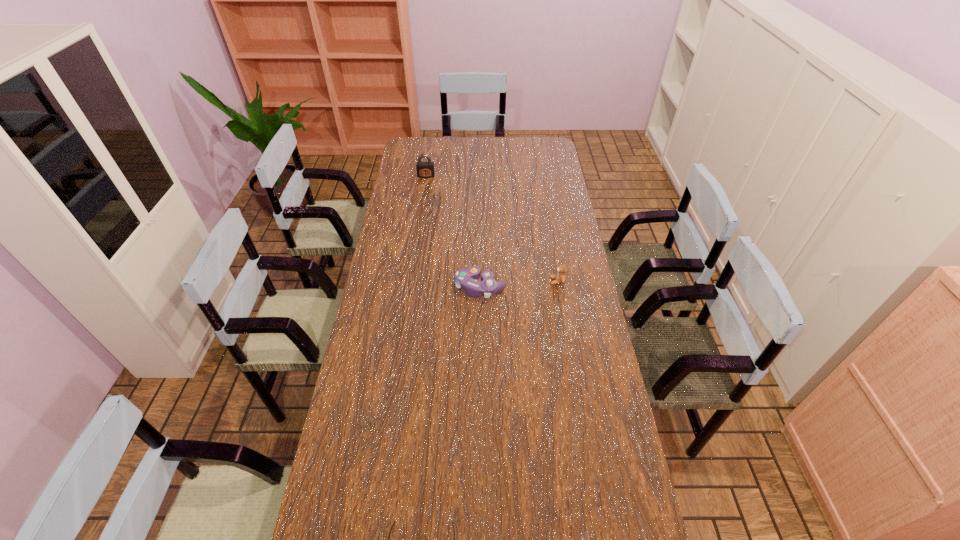
Find the location of a particular element. Image resolution: width=960 pixels, height=540 pixels. vacant space that is in between the teddy bear and the control is located at coordinates (518, 285).

The height and width of the screenshot is (540, 960). I want to click on object that is the closest to the rightmost object, so click(x=465, y=278).

Locate which object is the second closest to the control. Please provide its 2D coordinates. Your answer should be formatted as a tuple, i.e. [(x, y)], where the tuple contains the x and y coordinates of a point satisfying the conditions above.

[(424, 169)]

Where is `vacant position in the image that satisfies the following two spatial constraints: 1. on the front of the control near the keyhole; 2. on the right side of the leftmost object`? This screenshot has height=540, width=960. vacant position in the image that satisfies the following two spatial constraints: 1. on the front of the control near the keyhole; 2. on the right side of the leftmost object is located at coordinates (409, 288).

Locate an element on the screen. free space that satisfies the following two spatial constraints: 1. on the front of the control near the keyhole; 2. on the left side of the padlock is located at coordinates (x=409, y=288).